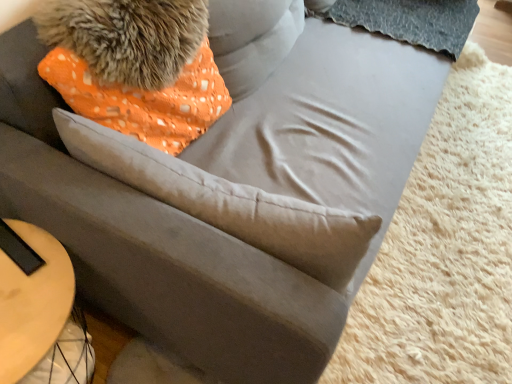
Where is `free space above light wood table at lower left (from a real-world perspective)`? The width and height of the screenshot is (512, 384). free space above light wood table at lower left (from a real-world perspective) is located at coordinates (29, 285).